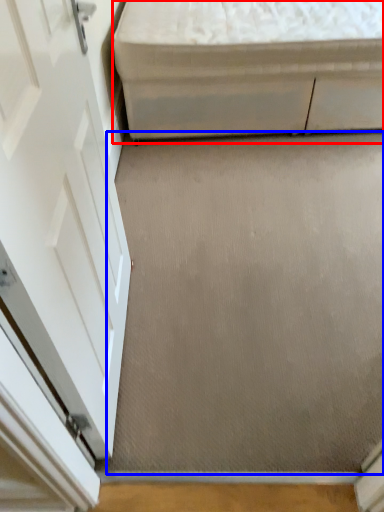
Question: Which of the following is the closest to the observer, furniture (highlighted by a red box) or concrete (highlighted by a blue box)?

Choices:
 (A) furniture
 (B) concrete

Answer: (B)